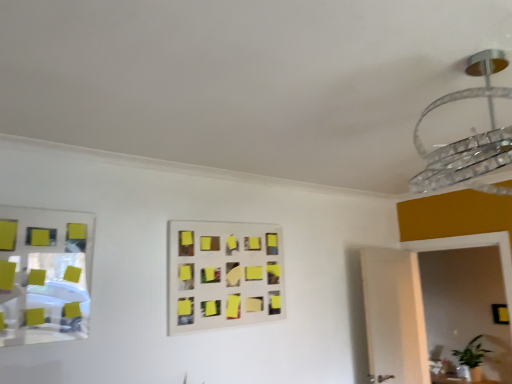
Question: Does point (x=494, y=311) appear closer or farther from the camera than point (x=82, y=243)?

Choices:
 (A) closer
 (B) farther

Answer: (B)

Question: Is black matte square at lower right taller or shorter than metallic reflective mirror at left?

Choices:
 (A) tall
 (B) short

Answer: (B)

Question: Which of these objects is positioned farthest from the black matte square at lower right?

Choices:
 (A) yellow sticky notes at center
 (B) clear glass chandelier at upper right
 (C) metallic reflective mirror at left

Answer: (C)

Question: Based on their relative distances, which object is farther from the black matte square at lower right?

Choices:
 (A) yellow sticky notes at center
 (B) metallic reflective mirror at left
 (C) clear glass chandelier at upper right

Answer: (B)